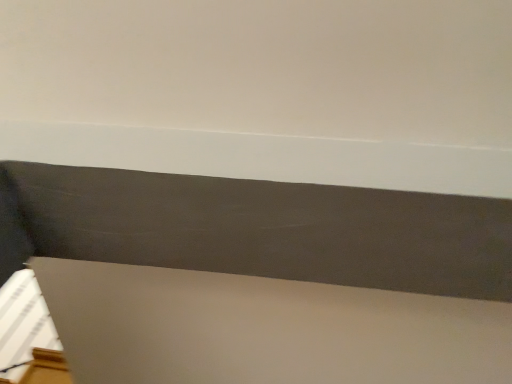
The height and width of the screenshot is (384, 512). Find the location of `free spot above matte gray board at lower center (from a real-world perspective)`. free spot above matte gray board at lower center (from a real-world perspective) is located at coordinates (269, 227).